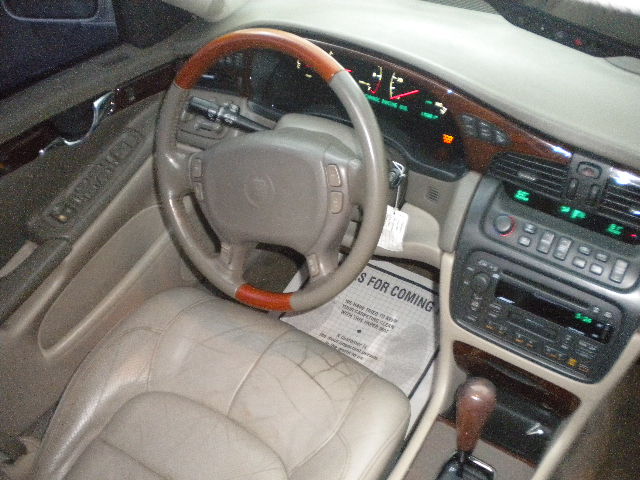
The width and height of the screenshot is (640, 480). I want to click on radio, so click(538, 312).